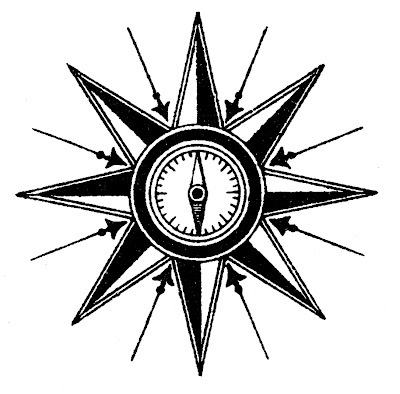
Identify the location of shaded clock hand. Image resolution: width=400 pixels, height=394 pixels. (197, 210).